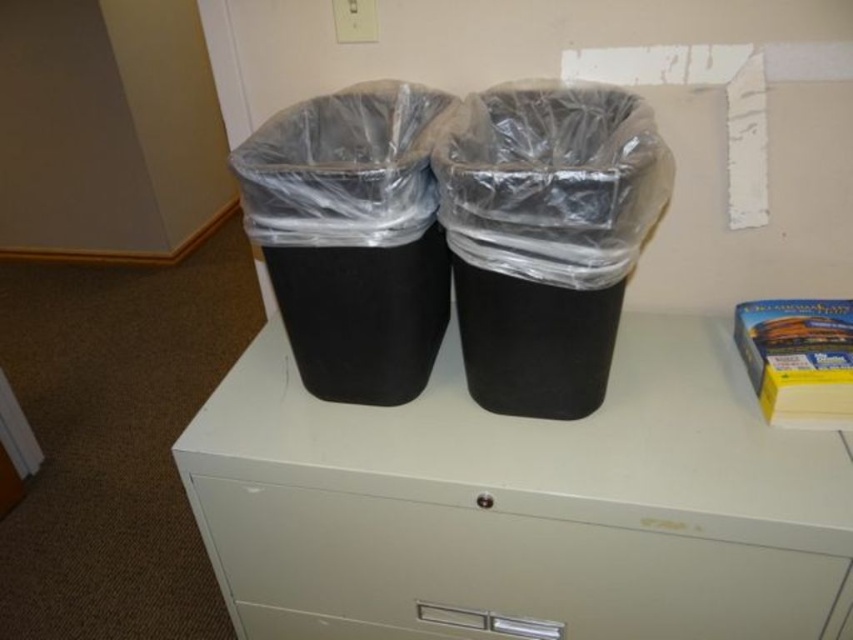
Can you confirm if white matte/file cabinet at center is positioned to the left of yellow cardboard box at upper right?

Yes, white matte/file cabinet at center is to the left of yellow cardboard box at upper right.

Measure the distance from white matte/file cabinet at center to yellow cardboard box at upper right.

white matte/file cabinet at center and yellow cardboard box at upper right are 11.90 inches apart from each other.

The height and width of the screenshot is (640, 853). I want to click on white matte/file cabinet at center, so click(521, 504).

This screenshot has height=640, width=853. What are the coordinates of `white matte/file cabinet at center` in the screenshot? It's located at (521, 504).

At what (x,y) coordinates should I click in order to perform the action: click on white matte drawer at center. Please return your answer as a coordinate pair (x, y). The image size is (853, 640). Looking at the image, I should click on (491, 572).

Does white matte drawer at center have a greater width compared to yellow cardboard box at upper right?

Yes.

The image size is (853, 640). I want to click on white matte drawer at center, so click(x=491, y=572).

In the scene shown: Is white matte/file cabinet at center to the left of white matte drawer at center from the viewer's perspective?

Incorrect, white matte/file cabinet at center is not on the left side of white matte drawer at center.

Measure the distance between point (792,620) and camera.

They are 92.60 centimeters apart.

Which is behind, point (712, 531) or point (440, 556)?

The point (440, 556) is more distant.

This screenshot has width=853, height=640. In order to click on white matte/file cabinet at center in this screenshot , I will do `click(521, 504)`.